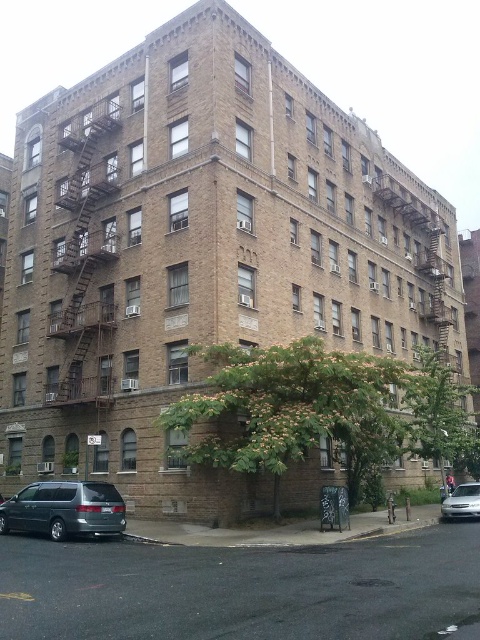
Question: Which object is the closest to the brown metal fire escape at left?

Choices:
 (A) silver metallic sedan at lower right
 (B) metallic gray minivan at lower left

Answer: (B)

Question: Is brown metal fire escape at left smaller than metallic gray minivan at lower left?

Choices:
 (A) no
 (B) yes

Answer: (A)

Question: Among these objects, which one is nearest to the camera?

Choices:
 (A) silver metallic sedan at lower right
 (B) metallic gray minivan at lower left
 (C) brown metal fire escape at left

Answer: (B)

Question: Does metallic gray minivan at lower left have a lesser width compared to silver metallic sedan at lower right?

Choices:
 (A) yes
 (B) no

Answer: (A)

Question: Is metallic gray minivan at lower left to the left of silver metallic sedan at lower right from the viewer's perspective?

Choices:
 (A) no
 (B) yes

Answer: (B)

Question: Which of these objects is positioned farthest from the brown metal fire escape at left?

Choices:
 (A) silver metallic sedan at lower right
 (B) metallic gray minivan at lower left

Answer: (A)